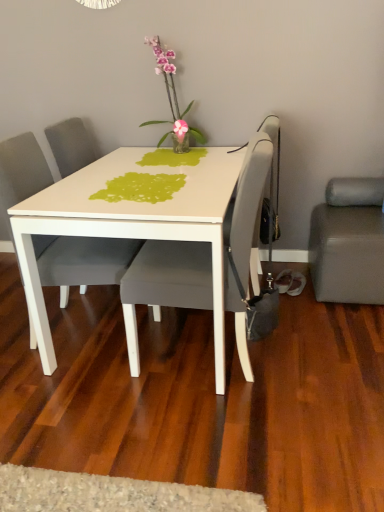
Question: Is suede gray studio couch at lower right bigger than translucent glass vase at upper center?

Choices:
 (A) no
 (B) yes

Answer: (B)

Question: Does suede gray studio couch at lower right lie behind translucent glass vase at upper center?

Choices:
 (A) yes
 (B) no

Answer: (B)

Question: Is translucent glass vase at upper center a part of suede gray studio couch at lower right?

Choices:
 (A) yes
 (B) no

Answer: (B)

Question: Can you confirm if suede gray studio couch at lower right is taller than translucent glass vase at upper center?

Choices:
 (A) no
 (B) yes

Answer: (A)

Question: From a real-world perspective, is suede gray studio couch at lower right physically above translucent glass vase at upper center?

Choices:
 (A) no
 (B) yes

Answer: (A)

Question: From a real-world perspective, relative to suede gray studio couch at lower right, is matte gray chair at center, which is counted as the first chair, starting from the right, vertically above or below?

Choices:
 (A) above
 (B) below

Answer: (A)

Question: Would you say matte gray chair at center, which is counted as the first chair, starting from the right, is inside or outside suede gray studio couch at lower right?

Choices:
 (A) inside
 (B) outside

Answer: (B)

Question: Considering the positions of matte gray chair at center, the 2th chair in the left-to-right sequence, and suede gray studio couch at lower right in the image, is matte gray chair at center, the 2th chair in the left-to-right sequence, taller or shorter than suede gray studio couch at lower right?

Choices:
 (A) tall
 (B) short

Answer: (A)

Question: From the image's perspective, is matte gray chair at center, the 2th chair in the left-to-right sequence, positioned above or below suede gray studio couch at lower right?

Choices:
 (A) below
 (B) above

Answer: (A)

Question: Is point (48, 250) closer or farther from the camera than point (344, 246)?

Choices:
 (A) closer
 (B) farther

Answer: (A)

Question: From the image's perspective, relative to suede gray studio couch at lower right, is matte gray chair at center, which appears as the 2th chair when viewed from the right, above or below?

Choices:
 (A) above
 (B) below

Answer: (A)

Question: Based on their positions, is matte gray chair at center, which appears as the 2th chair when viewed from the right, located to the left or right of suede gray studio couch at lower right?

Choices:
 (A) right
 (B) left

Answer: (B)

Question: Is matte gray chair at center, the first chair viewed from the left, situated inside suede gray studio couch at lower right or outside?

Choices:
 (A) inside
 (B) outside

Answer: (B)

Question: Is matte gray chair at center, the 2th chair in the left-to-right sequence, taller or shorter than translucent glass vase at upper center?

Choices:
 (A) short
 (B) tall

Answer: (B)

Question: Is matte gray chair at center, the 2th chair in the left-to-right sequence, in front of or behind translucent glass vase at upper center in the image?

Choices:
 (A) behind
 (B) front

Answer: (B)